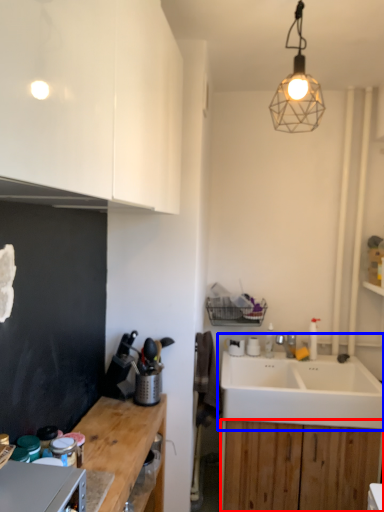
Question: Which object appears farthest to the camera in this image, cabinetry (highlighted by a red box) or sink (highlighted by a blue box)?

Choices:
 (A) cabinetry
 (B) sink

Answer: (A)